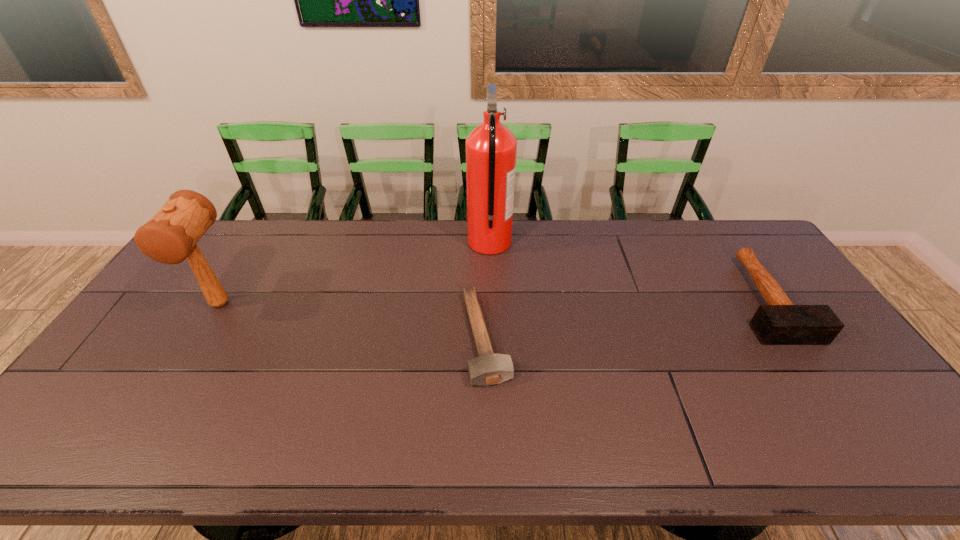
This screenshot has height=540, width=960. In order to click on vacant point located on the strike surface of the leftmost mallet in this screenshot , I will do `click(171, 384)`.

Find the location of a particular element. vacant position located 0.240m on the hammer head face of the rightmost mallet is located at coordinates (850, 424).

Image resolution: width=960 pixels, height=540 pixels. Identify the location of free space located on the back of the second mallet from right to left. (485, 248).

The image size is (960, 540). I want to click on fire extinguisher at the far edge, so click(x=491, y=148).

Identify the location of mallet present at the far edge. (780, 322).

The image size is (960, 540). In order to click on object at the left edge in this screenshot , I will do `click(171, 235)`.

Where is `object at the right edge`? The width and height of the screenshot is (960, 540). object at the right edge is located at coordinates (780, 322).

This screenshot has width=960, height=540. Find the location of `object located in the far right corner section of the desktop`. object located in the far right corner section of the desktop is located at coordinates (780, 322).

What are the coordinates of `free space at the far edge` in the screenshot? It's located at (697, 246).

You are a GUI agent. You are given a task and a screenshot of the screen. Output one action in this format:
    pyautogui.click(x=<x>, y=<y>)
    Task: Click on the blank space at the near edge of the desktop
    
    Given the screenshot: What is the action you would take?
    pyautogui.click(x=317, y=433)